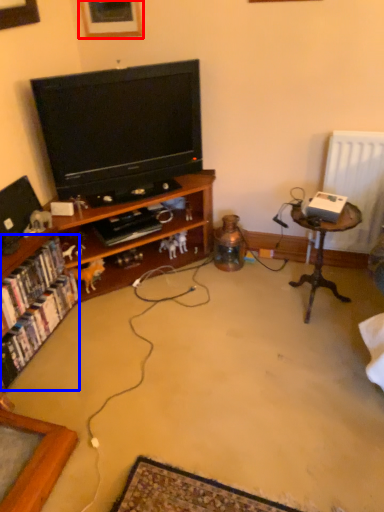
Question: Among these objects, which one is farthest to the camera, picture frame (highlighted by a red box) or book (highlighted by a blue box)?

Choices:
 (A) picture frame
 (B) book

Answer: (A)